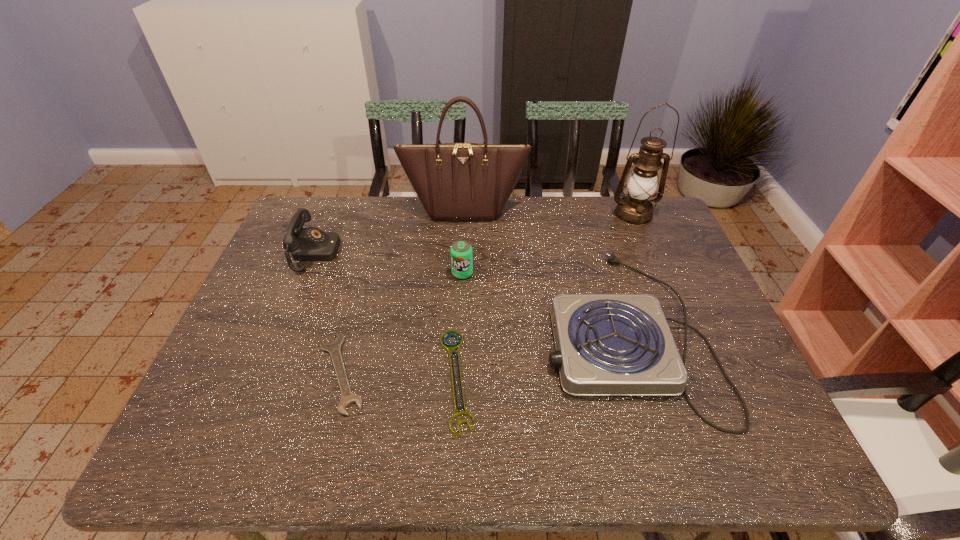
Where is `wrench positioned at the near edge`? The height and width of the screenshot is (540, 960). wrench positioned at the near edge is located at coordinates (448, 347).

Where is `object present at the left edge`? This screenshot has width=960, height=540. object present at the left edge is located at coordinates (309, 244).

In order to click on oil lamp located at the right edge in this screenshot , I will do `click(635, 209)`.

Locate an element on the screen. The width and height of the screenshot is (960, 540). hotplate located in the right edge section of the desktop is located at coordinates (606, 344).

The image size is (960, 540). In order to click on object situated at the far left corner in this screenshot , I will do `click(309, 244)`.

I want to click on object present at the far right corner, so click(x=635, y=209).

At what (x,y) coordinates should I click in order to perform the action: click on object at the near right corner. Please return your answer as a coordinate pair (x, y). This screenshot has height=540, width=960. Looking at the image, I should click on (606, 344).

At what (x,y) coordinates should I click in order to perform the action: click on free region at the far edge. Please return your answer as a coordinate pair (x, y). The width and height of the screenshot is (960, 540). Looking at the image, I should click on (385, 234).

Where is `vacant region at the near edge of the desktop`? This screenshot has width=960, height=540. vacant region at the near edge of the desktop is located at coordinates (665, 441).

Where is `vacant area at the left edge`? vacant area at the left edge is located at coordinates (246, 342).